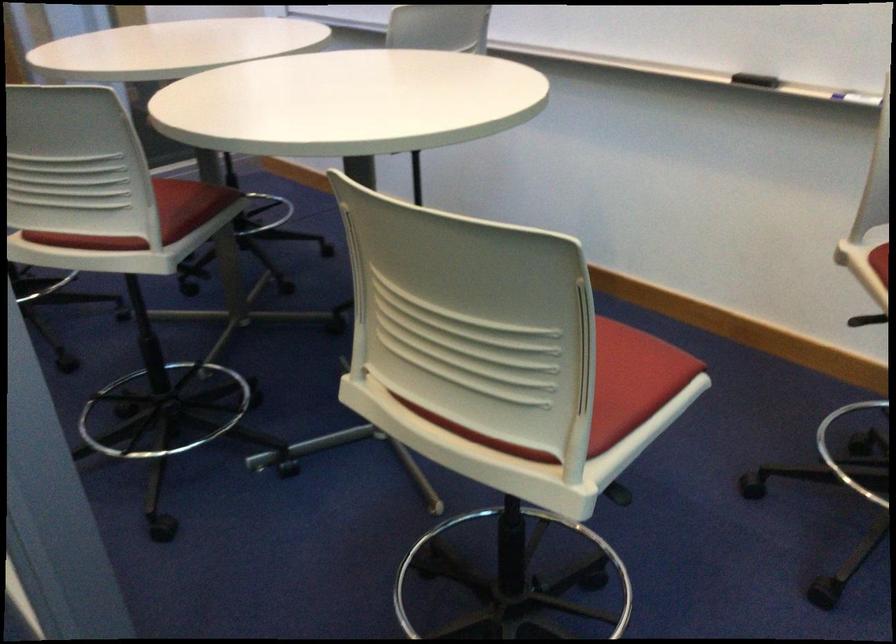
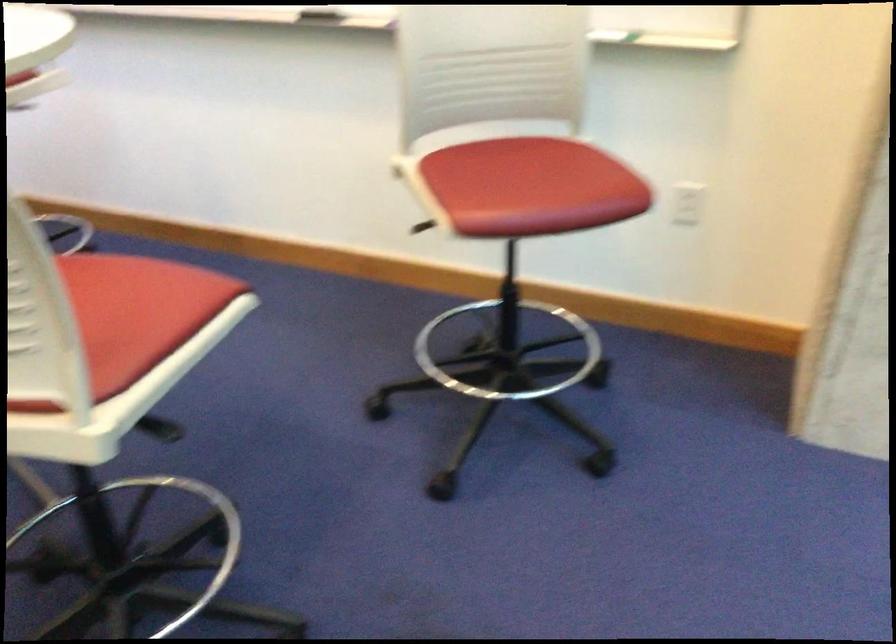
Question: Which direction would the cameraman need to move to produce the second image? Reply with the corresponding letter.

Choices:
 (A) Left
 (B) Right
 (C) Forward
 (D) Backward

Answer: (B)